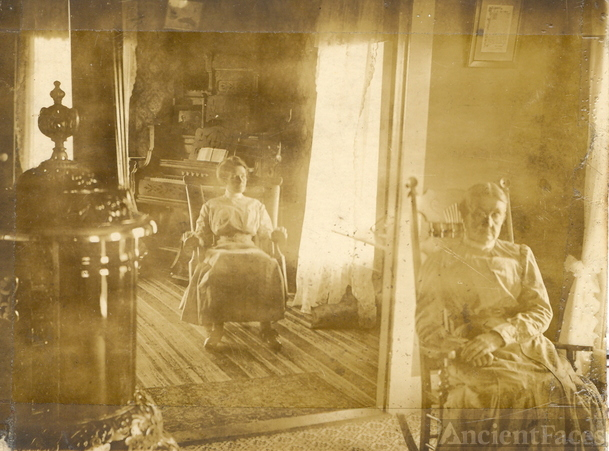
The image size is (609, 451). Find the location of `wall`. wall is located at coordinates (284, 68), (500, 124).